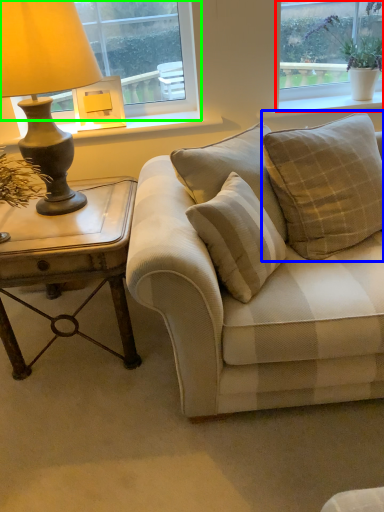
Question: Which object is positioned closest to window (highlighted by a red box)? Select from pillow (highlighted by a blue box) and window (highlighted by a green box).

Choices:
 (A) pillow
 (B) window

Answer: (B)